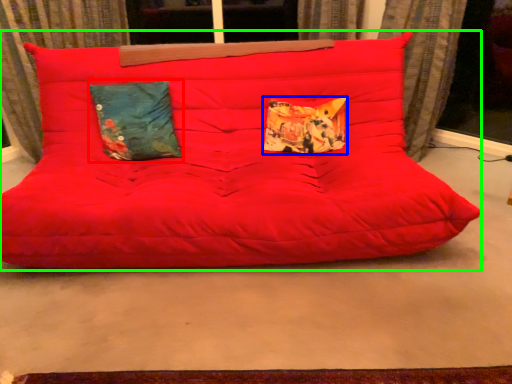
Question: Which object is positioned farthest from pillow (highlighted by a red box)? Select from pillow (highlighted by a blue box) and studio couch (highlighted by a green box).

Choices:
 (A) pillow
 (B) studio couch

Answer: (A)